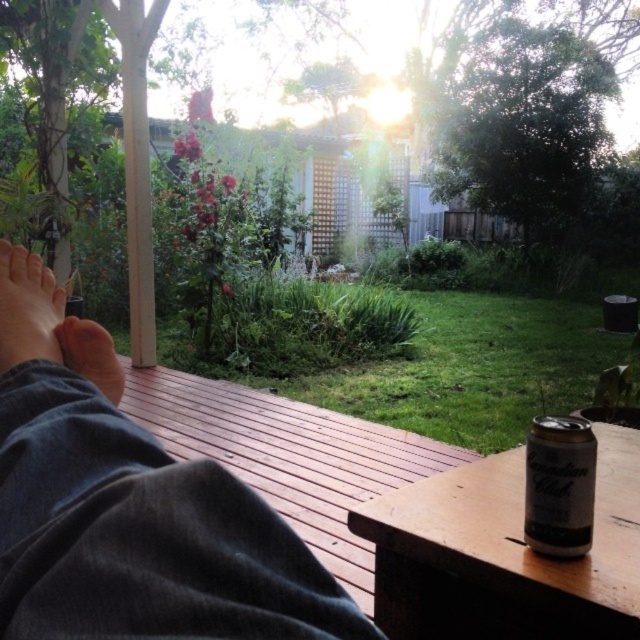
Who is more distant from viewer, (547, 472) or (44, 349)?

Positioned behind is point (547, 472).

Can you confirm if silver metallic can at lower right is positioned to the right of smooth skin foot at lower left?

Indeed, silver metallic can at lower right is positioned on the right side of smooth skin foot at lower left.

Describe the element at coordinates (560, 484) in the screenshot. I see `silver metallic can at lower right` at that location.

Where is `silver metallic can at lower right`? This screenshot has width=640, height=640. silver metallic can at lower right is located at coordinates (560, 484).

Can you confirm if silver metallic can at lower right is shorter than brown suede foot at lower left?

No, silver metallic can at lower right is not shorter than brown suede foot at lower left.

Can you confirm if silver metallic can at lower right is positioned below brown suede foot at lower left?

Yes, silver metallic can at lower right is below brown suede foot at lower left.

Who is more forward, (580, 532) or (77, 369)?

Point (77, 369) is more forward.

Identify the location of silver metallic can at lower right. This screenshot has width=640, height=640. (560, 484).

Is dark gray fabric at lower left to the left of smooth skin foot at lower left from the viewer's perspective?

Incorrect, dark gray fabric at lower left is not on the left side of smooth skin foot at lower left.

Find the location of `dark gray fabric at lower left`. dark gray fabric at lower left is located at coordinates (129, 513).

What do you see at coordinates (129, 513) in the screenshot?
I see `dark gray fabric at lower left` at bounding box center [129, 513].

At what (x,y) coordinates should I click in order to perform the action: click on dark gray fabric at lower left. Please return your answer as a coordinate pair (x, y). This screenshot has width=640, height=640. Looking at the image, I should click on (129, 513).